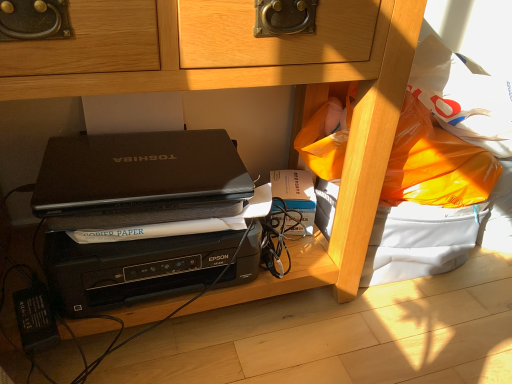
What do you see at coordinates (136, 213) in the screenshot? I see `black matte laptop at center` at bounding box center [136, 213].

The image size is (512, 384). Identify the location of black matte laptop at center. (136, 213).

The height and width of the screenshot is (384, 512). What do you see at coordinates (137, 169) in the screenshot?
I see `matte black laptop at center` at bounding box center [137, 169].

Measure the distance between matte black laptop at center and camera.

matte black laptop at center and camera are 36.91 inches apart from each other.

The image size is (512, 384). Find the location of `black matte laptop at center`. black matte laptop at center is located at coordinates (136, 213).

Does matte black laptop at center have a greater width compared to black matte laptop at center?

In fact, matte black laptop at center might be narrower than black matte laptop at center.

Is matte black laptop at center far away from black matte laptop at center?

That's not correct — matte black laptop at center is a little close to black matte laptop at center.

Which object is closer to the camera, matte black laptop at center or black matte laptop at center?

matte black laptop at center is closer to the camera.

How far apart are matte black laptop at center and black matte laptop at center?

11.89 inches.

Image resolution: width=512 pixels, height=384 pixels. Identify the location of computer on the left of hardcover book at center. (136, 213).

From a real-world perspective, which is physically below, black matte laptop at center or hardcover book at center?

From a 3D spatial view, hardcover book at center is below.

Considering the positions of points (133, 152) and (300, 184), is point (133, 152) farther from camera compared to point (300, 184)?

That is False.

Can you see black matte laptop at center touching hardcover book at center?

No, black matte laptop at center is not next to hardcover book at center.

From the image's perspective, between black matte laptop at center and matte black laptop at center, which one is located above?

matte black laptop at center is shown above in the image.

From a real-world perspective, who is located higher, black matte laptop at center or matte black laptop at center?

In real-world perspective, matte black laptop at center is above.

Is black matte laptop at center in contact with matte black laptop at center?

No, black matte laptop at center is not beside matte black laptop at center.

Find the location of a particular element. computer that is behind the matte black laptop at center is located at coordinates (136, 213).

Can you confirm if matte black laptop at center is positioned to the left of hardcover book at center?

Correct, you'll find matte black laptop at center to the left of hardcover book at center.

From a real-world perspective, is matte black laptop at center above or below hardcover book at center?

matte black laptop at center is above hardcover book at center.

Are matte black laptop at center and hardcover book at center making contact?

No, matte black laptop at center is not making contact with hardcover book at center.

Can you tell me how much matte black laptop at center and hardcover book at center differ in facing direction?

17.5 degrees separate the facing orientations of matte black laptop at center and hardcover book at center.

From the picture: From a real-world perspective, is hardcover book at center positioned over black matte laptop at center based on gravity?

No, from a real-world perspective, hardcover book at center is not above black matte laptop at center.

Can you confirm if hardcover book at center is thinner than black matte laptop at center?

Indeed, hardcover book at center has a lesser width compared to black matte laptop at center.

Considering the sizes of hardcover book at center and black matte laptop at center in the image, is hardcover book at center bigger or smaller than black matte laptop at center?

hardcover book at center is smaller than black matte laptop at center.

Is hardcover book at center far from black matte laptop at center?

No.

Between hardcover book at center and matte black laptop at center, which one appears on the left side from the viewer's perspective?

matte black laptop at center.

Which of these two, hardcover book at center or matte black laptop at center, is smaller?

hardcover book at center is smaller.

Which is behind, hardcover book at center or matte black laptop at center?

Positioned behind is hardcover book at center.

Could matte black laptop at center be considered to be inside hardcover book at center?

Actually, matte black laptop at center is outside hardcover book at center.

The width and height of the screenshot is (512, 384). What are the coordinates of `computer below the matte black laptop at center (from the image's perspective)` in the screenshot? It's located at (136, 213).

I want to click on computer in front of the hardcover book at center, so click(x=136, y=213).

Looking at the image, which one is located closer to black matte laptop at center, matte black laptop at center or hardcover book at center?

Based on the image, hardcover book at center appears to be nearer to black matte laptop at center.

Based on their spatial positions, is matte black laptop at center or black matte laptop at center closer to hardcover book at center?

Based on the image, matte black laptop at center appears to be nearer to hardcover book at center.

Considering their positions, is black matte laptop at center positioned further to matte black laptop at center than hardcover book at center?

Among the two, black matte laptop at center is located further to matte black laptop at center.

Based on the photo, considering their positions, is hardcover book at center positioned further to black matte laptop at center than matte black laptop at center?

The object further to black matte laptop at center is matte black laptop at center.

Considering their positions, is hardcover book at center positioned closer to matte black laptop at center than black matte laptop at center?

Among the two, hardcover book at center is located nearer to matte black laptop at center.

Looking at this image, from the image, which object appears to be farther from hardcover book at center, black matte laptop at center or matte black laptop at center?

black matte laptop at center is further to hardcover book at center.

The width and height of the screenshot is (512, 384). Find the location of `laptop located between black matte laptop at center and hardcover book at center in the left-right direction`. laptop located between black matte laptop at center and hardcover book at center in the left-right direction is located at coordinates (137, 169).